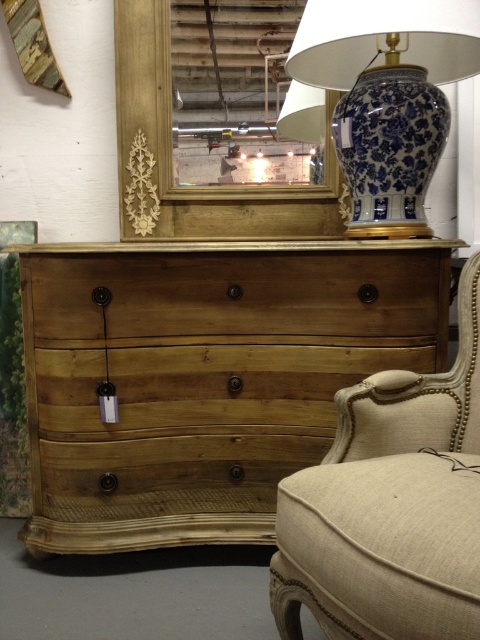
Which of these two, natural wood dresser at center or blue and white porcelain vase at upper right, stands shorter?

With less height is blue and white porcelain vase at upper right.

Is point (143, 252) less distant than point (320, 28)?

No.

The image size is (480, 640). In order to click on natural wood dresser at center in this screenshot , I will do `click(204, 376)`.

What do you see at coordinates (204, 376) in the screenshot? I see `natural wood dresser at center` at bounding box center [204, 376].

Is natural wood dresser at center to the right of beige fabric swivel chair at right from the viewer's perspective?

In fact, natural wood dresser at center is to the left of beige fabric swivel chair at right.

Locate an element on the screen. natural wood dresser at center is located at coordinates (204, 376).

Which is above, beige fabric swivel chair at right or blue and white porcelain vase at upper right?

blue and white porcelain vase at upper right

Between point (445, 433) and point (355, 186), which one is positioned in front?

Point (445, 433) is more forward.

Identify the location of beige fabric swivel chair at right. The width and height of the screenshot is (480, 640). (391, 506).